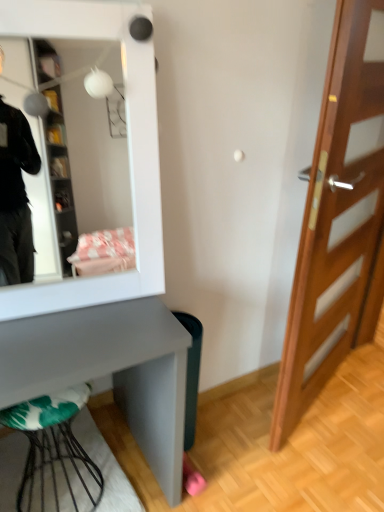
At what (x,y) coordinates should I click in order to perform the action: click on free space to the left of wooden door at right. Please return your answer as a coordinate pair (x, y). Image resolution: width=384 pixels, height=512 pixels. Looking at the image, I should click on (244, 418).